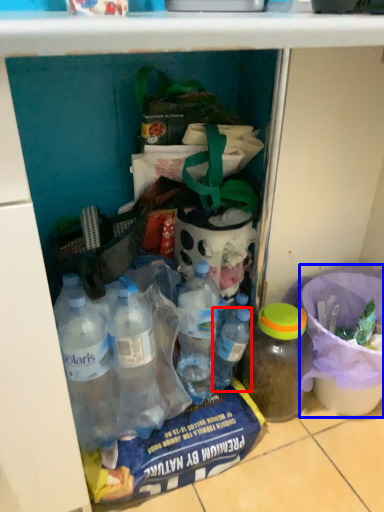
Question: Which of the following is the farthest to the observer, bottle (highlighted by a red box) or bucket (highlighted by a blue box)?

Choices:
 (A) bottle
 (B) bucket

Answer: (A)